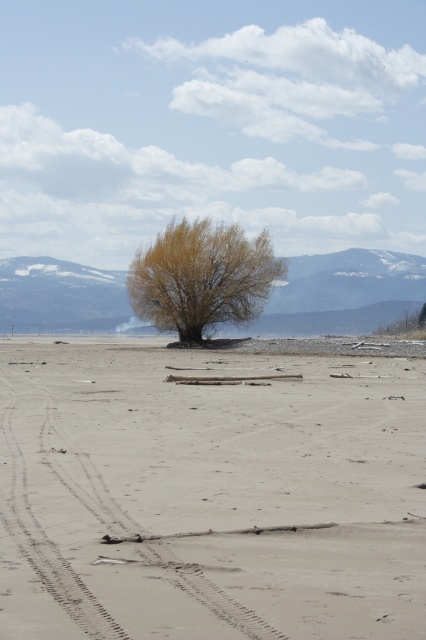
Who is higher up, brown sandy dirt field at center or yellow-green leafy tree at center?

yellow-green leafy tree at center

Does brown sandy dirt field at center have a smaller size compared to yellow-green leafy tree at center?

Correct, brown sandy dirt field at center occupies less space than yellow-green leafy tree at center.

Who is more distant from viewer, [62,365] or [227,260]?

Point [227,260]

Where is `brown sandy dirt field at center`? brown sandy dirt field at center is located at coordinates (209, 497).